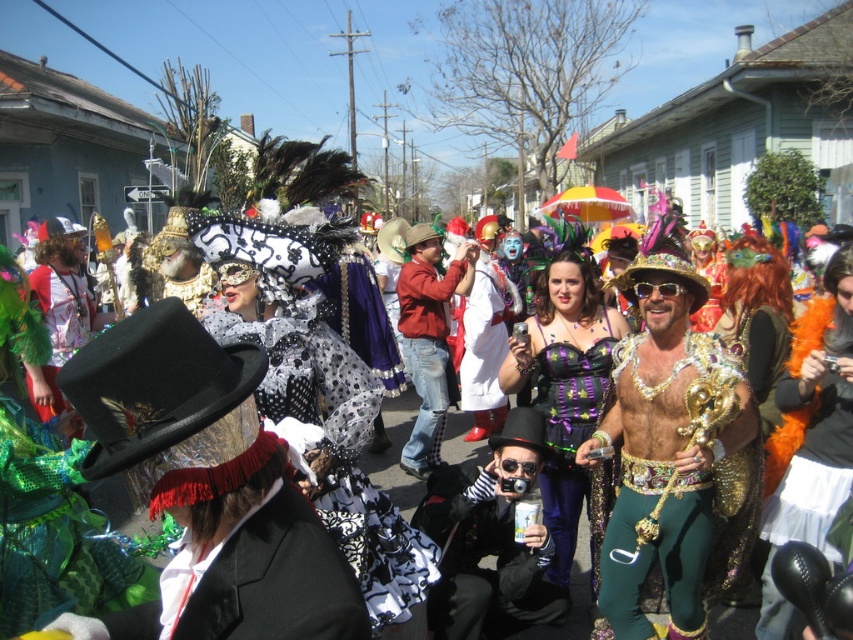
Does gold sequined hat at center appear under sparkly gold dress at center?

Indeed, gold sequined hat at center is positioned under sparkly gold dress at center.

Does gold sequined hat at center appear on the right side of sparkly gold dress at center?

Incorrect, gold sequined hat at center is not on the right side of sparkly gold dress at center.

Who is more distant from viewer, (608, 596) or (767, 420)?

Point (767, 420)

This screenshot has width=853, height=640. Identify the location of gold sequined hat at center. (664, 440).

Does shiny black top hat at center have a greater height compared to sparkly gold dress at center?

In fact, shiny black top hat at center may be shorter than sparkly gold dress at center.

Who is positioned more to the right, shiny black top hat at center or sparkly gold dress at center?

Positioned to the right is sparkly gold dress at center.

Is point (445, 552) positioned behind point (718, 321)?

No, (445, 552) is in front of (718, 321).

You are a GUI agent. You are given a task and a screenshot of the screen. Output one action in this format:
    pyautogui.click(x=<x>, y=<y>)
    Task: Click on the shiny black top hat at center
    The image size is (853, 640).
    Given the screenshot: What is the action you would take?
    pyautogui.click(x=490, y=540)

Is point (544, 449) positioned after point (564, 285)?

No, it is not.

Can you confirm if shiny black top hat at center is shorter than purple sequined corset at center?

Yes.

The height and width of the screenshot is (640, 853). I want to click on shiny black top hat at center, so click(490, 540).